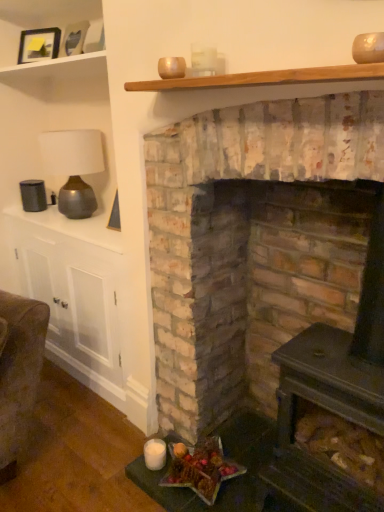
Question: Considering the relative sizes of wooden picture frame at upper left, the 1th picture frame viewed from the right, and matte brown lamp at upper left in the image provided, is wooden picture frame at upper left, the 1th picture frame viewed from the right, bigger than matte brown lamp at upper left?

Choices:
 (A) no
 (B) yes

Answer: (A)

Question: Can you confirm if wooden picture frame at upper left, the 2th picture frame from the back, is shorter than matte brown lamp at upper left?

Choices:
 (A) yes
 (B) no

Answer: (A)

Question: Considering the relative sizes of wooden picture frame at upper left, which is the second picture frame in left-to-right order, and matte brown lamp at upper left in the image provided, is wooden picture frame at upper left, which is the second picture frame in left-to-right order, smaller than matte brown lamp at upper left?

Choices:
 (A) no
 (B) yes

Answer: (B)

Question: From the image's perspective, is wooden picture frame at upper left, acting as the first picture frame starting from the front, located above matte brown lamp at upper left?

Choices:
 (A) yes
 (B) no

Answer: (A)

Question: Is wooden picture frame at upper left, which is the second picture frame in left-to-right order, next to matte brown lamp at upper left?

Choices:
 (A) yes
 (B) no

Answer: (B)

Question: From the image's perspective, is wooden picture frame at upper left, acting as the first picture frame starting from the front, located beneath matte brown lamp at upper left?

Choices:
 (A) no
 (B) yes

Answer: (A)

Question: Is wooden plank at upper center, which appears as the 1th shelf when viewed from the front, at the back of matte black picture frame at upper left, which appears as the 1th picture frame when viewed from the left?

Choices:
 (A) yes
 (B) no

Answer: (B)

Question: Is matte black picture frame at upper left, the second picture frame when ordered from front to back, facing towards wooden plank at upper center, the 1th shelf in the right-to-left sequence?

Choices:
 (A) yes
 (B) no

Answer: (B)

Question: Is matte black picture frame at upper left, placed as the 2th picture frame when sorted from right to left, shorter than wooden plank at upper center, which appears as the 1th shelf when viewed from the front?

Choices:
 (A) yes
 (B) no

Answer: (B)

Question: Considering the relative sizes of matte black picture frame at upper left, which appears as the 1th picture frame when viewed from the left, and wooden plank at upper center, the second shelf when ordered from back to front, in the image provided, is matte black picture frame at upper left, which appears as the 1th picture frame when viewed from the left, taller than wooden plank at upper center, the second shelf when ordered from back to front,?

Choices:
 (A) yes
 (B) no

Answer: (A)

Question: Is matte black picture frame at upper left, which appears as the 1th picture frame when viewed from the left, not near wooden plank at upper center, positioned as the 1th shelf in bottom-to-top order?

Choices:
 (A) no
 (B) yes

Answer: (B)

Question: Is matte black picture frame at upper left, placed as the 2th picture frame when sorted from right to left, smaller than wooden plank at upper center, which is the 2th shelf from left to right?

Choices:
 (A) yes
 (B) no

Answer: (A)

Question: Are wooden plank at upper center, the second shelf when ordered from back to front, and wooden picture frame at upper left, the 1th picture frame viewed from the right, beside each other?

Choices:
 (A) no
 (B) yes

Answer: (A)